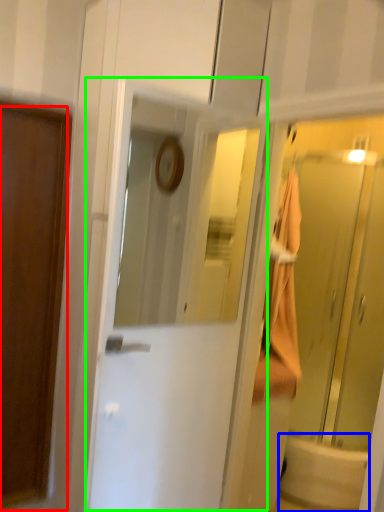
Question: Which object is positioned farthest from door (highlighted by a red box)? Select from bath (highlighted by a blue box) and door (highlighted by a green box).

Choices:
 (A) bath
 (B) door

Answer: (A)